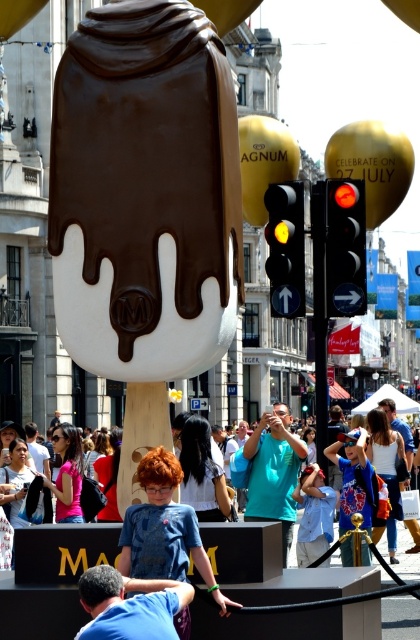
Question: Based on their relative distances, which object is nearer to the smooth chocolate ice cream at center?

Choices:
 (A) blue cotton shirt at lower center
 (B) teal t-shirt at center
 (C) denim shirt at center

Answer: (A)

Question: Does blue t-shirt at center appear on the right side of denim shirt at center?

Choices:
 (A) yes
 (B) no

Answer: (B)

Question: Which object is farther from the camera taking this photo?

Choices:
 (A) teal t-shirt at center
 (B) matte white crowd at center

Answer: (A)

Question: In this image, where is blue cotton shirt at lower center located relative to teal t-shirt at center?

Choices:
 (A) below
 (B) above

Answer: (B)

Question: Estimate the real-world distances between objects in this image. Which object is closer to the blue cotton shirt at lower center?

Choices:
 (A) denim shirt at center
 (B) denim jacket at center
 (C) smooth chocolate ice cream at center
 (D) matte white crowd at center

Answer: (D)

Question: Can you confirm if smooth chocolate ice cream at center is positioned to the right of teal t-shirt at center?

Choices:
 (A) yes
 (B) no

Answer: (B)